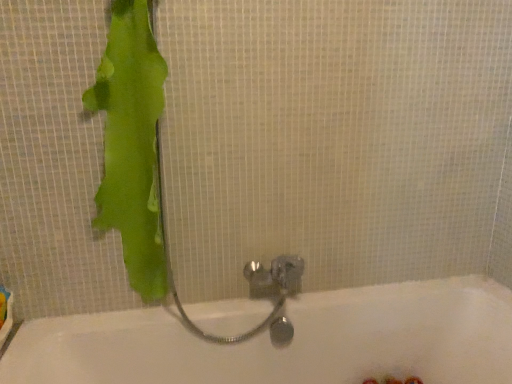
Question: Are white glossy bathtub at center and green matte towel at left far apart?

Choices:
 (A) no
 (B) yes

Answer: (A)

Question: Does white glossy bathtub at center have a lesser height compared to green matte towel at left?

Choices:
 (A) no
 (B) yes

Answer: (B)

Question: From a real-world perspective, is white glossy bathtub at center physically below green matte towel at left?

Choices:
 (A) no
 (B) yes

Answer: (B)

Question: From the image's perspective, is white glossy bathtub at center on top of green matte towel at left?

Choices:
 (A) yes
 (B) no

Answer: (B)

Question: Is white glossy bathtub at center bigger than green matte towel at left?

Choices:
 (A) no
 (B) yes

Answer: (B)

Question: Is white glossy bathtub at center smaller than green matte towel at left?

Choices:
 (A) yes
 (B) no

Answer: (B)

Question: Is green matte towel at left positioned with its back to white glossy bathtub at center?

Choices:
 (A) no
 (B) yes

Answer: (A)

Question: Does green matte towel at left come behind white glossy bathtub at center?

Choices:
 (A) no
 (B) yes

Answer: (B)

Question: From a real-world perspective, is green matte towel at left physically above white glossy bathtub at center?

Choices:
 (A) yes
 (B) no

Answer: (A)

Question: Is green matte towel at left thinner than white glossy bathtub at center?

Choices:
 (A) yes
 (B) no

Answer: (A)

Question: Considering the relative sizes of green matte towel at left and white glossy bathtub at center in the image provided, is green matte towel at left wider than white glossy bathtub at center?

Choices:
 (A) yes
 (B) no

Answer: (B)

Question: From the image's perspective, is green matte towel at left over white glossy bathtub at center?

Choices:
 (A) no
 (B) yes

Answer: (B)

Question: Considering the positions of green matte towel at left and white glossy bathtub at center in the image, is green matte towel at left bigger or smaller than white glossy bathtub at center?

Choices:
 (A) big
 (B) small

Answer: (B)